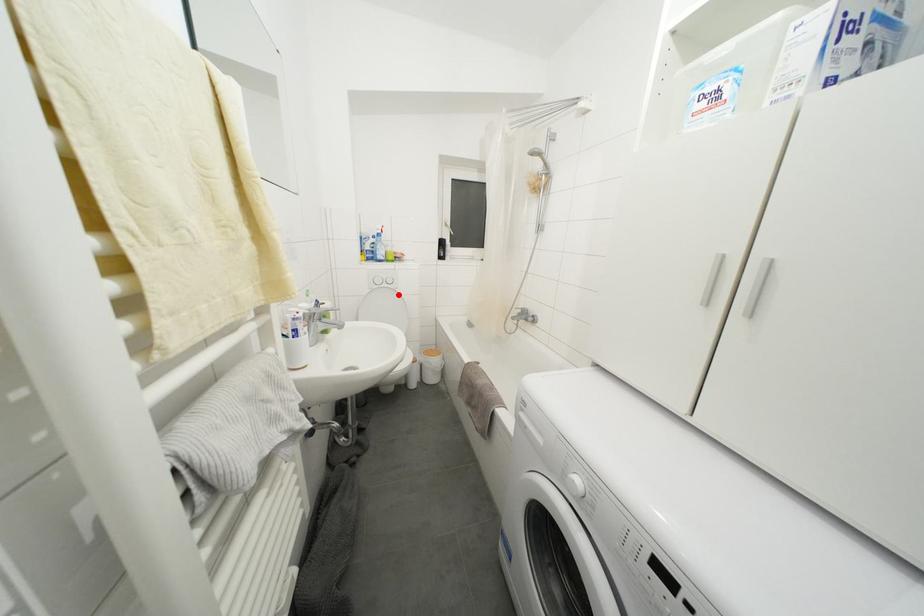
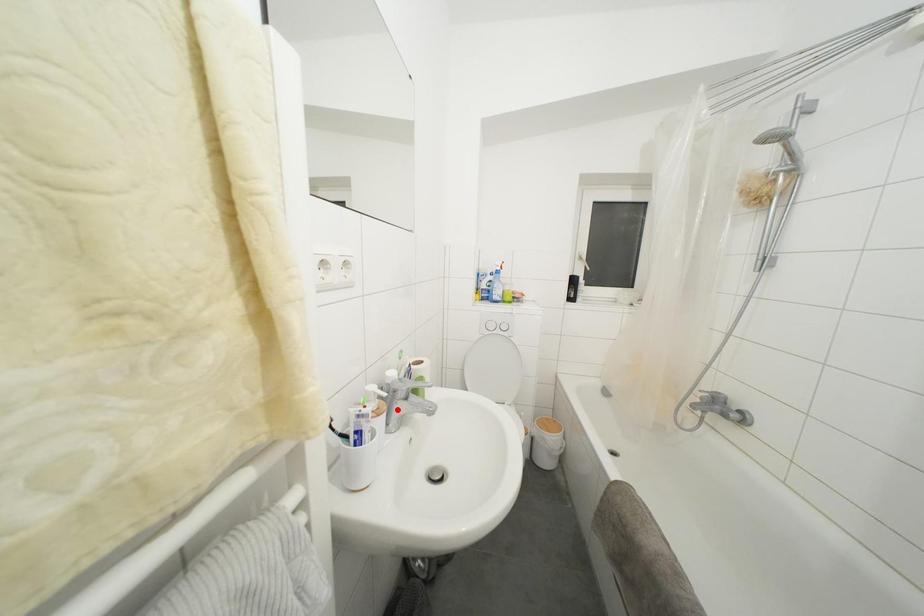
I am providing you with two images of the same scene from different viewpoints. A red point is marked on the first image and another point is marked on the second image. Is the marked point in image1 the same physical position as the marked point in image2?

No